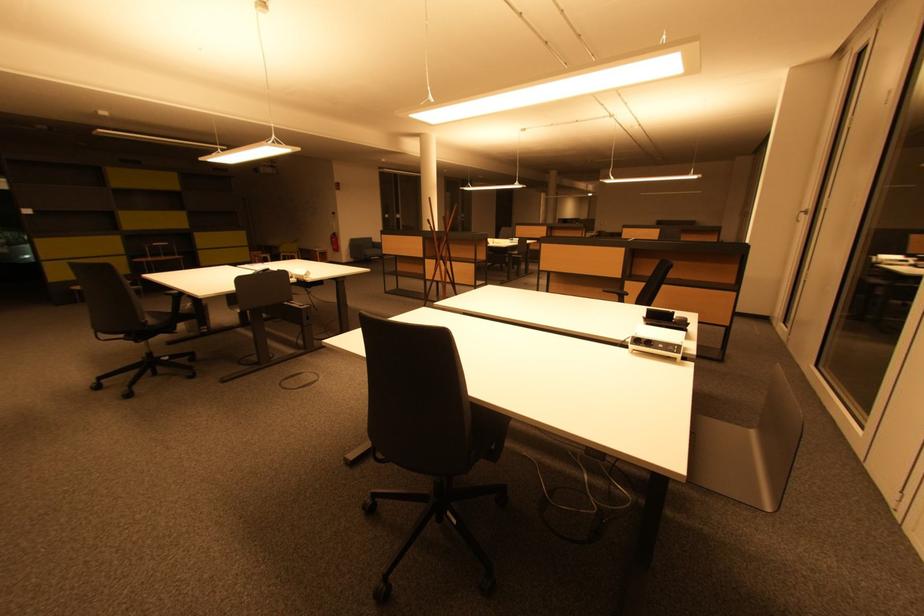
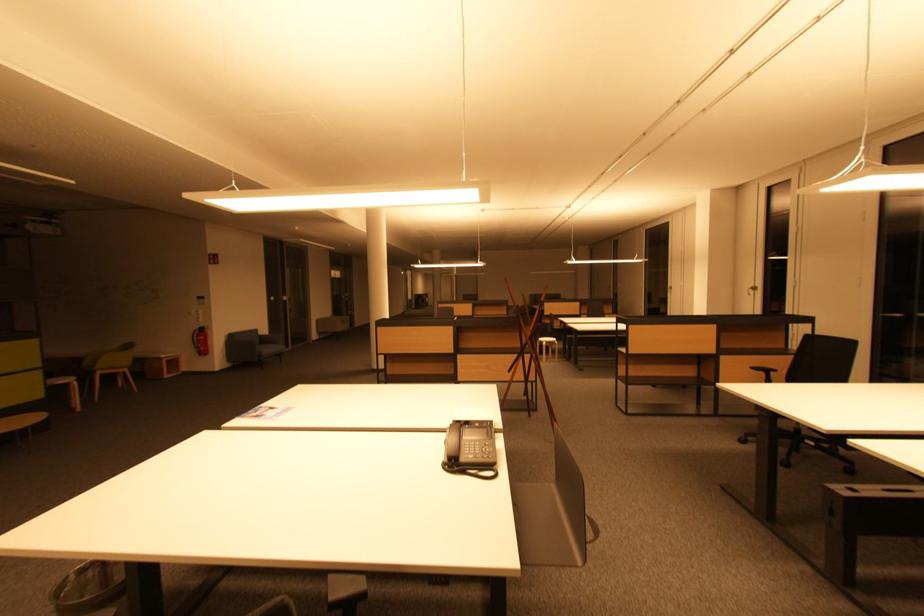
In the second image, find the point that corresponds to point (284, 256) in the first image.

(98, 374)